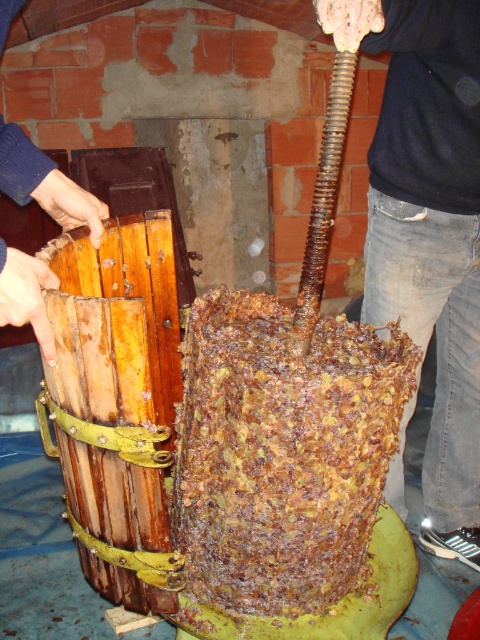
Question: Which point appears closest to the camera in this image?

Choices:
 (A) (455, 390)
 (B) (100, 236)
 (C) (337, 548)

Answer: (C)

Question: Considering the relative positions of jeans at center and wooden crate at left in the image provided, where is jeans at center located with respect to wooden crate at left?

Choices:
 (A) above
 (B) below

Answer: (B)

Question: Among these objects, which one is farthest from the camera?

Choices:
 (A) rusty metallic barrel at center
 (B) jeans at center

Answer: (A)

Question: Is jeans at center above wooden crate at left?

Choices:
 (A) no
 (B) yes

Answer: (A)

Question: Which object is positioned farthest from the jeans at center?

Choices:
 (A) wooden crate at left
 (B) rusty metallic barrel at center

Answer: (A)

Question: Considering the relative positions of rusty metallic barrel at center and wooden crate at left in the image provided, where is rusty metallic barrel at center located with respect to wooden crate at left?

Choices:
 (A) left
 (B) right

Answer: (B)